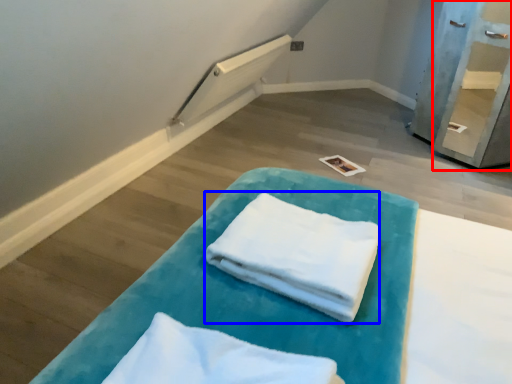
Question: Which object appears farthest to the camera in this image, shelf (highlighted by a red box) or cloth (highlighted by a blue box)?

Choices:
 (A) shelf
 (B) cloth

Answer: (A)